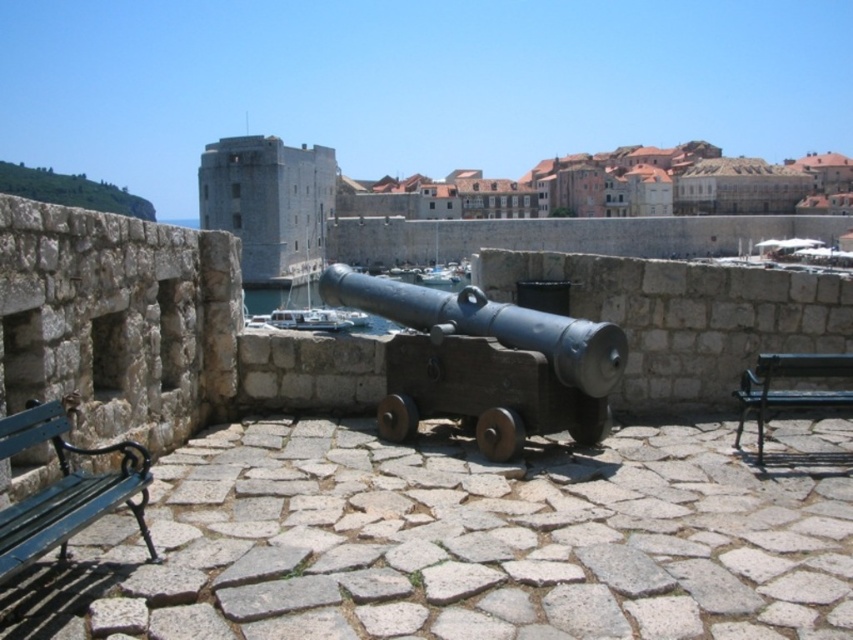
Is smooth stone cannon at center below green wooden bench at lower left?

Actually, smooth stone cannon at center is above green wooden bench at lower left.

Between smooth stone cannon at center and green wooden bench at lower left, which one is positioned higher?

smooth stone cannon at center

Identify the location of smooth stone cannon at center. (489, 209).

Is point (436, 337) farther from camera compared to point (3, 540)?

Yes.

The height and width of the screenshot is (640, 853). Describe the element at coordinates (485, 362) in the screenshot. I see `matte black cannon at center` at that location.

You are a GUI agent. You are given a task and a screenshot of the screen. Output one action in this format:
    pyautogui.click(x=<x>, y=<y>)
    Task: Click on the matte black cannon at center
    The width and height of the screenshot is (853, 640).
    Given the screenshot: What is the action you would take?
    pyautogui.click(x=485, y=362)

Can you confirm if smooth stone cannon at center is positioned to the left of matte black cannon at center?

No, smooth stone cannon at center is not to the left of matte black cannon at center.

Who is taller, smooth stone cannon at center or matte black cannon at center?

smooth stone cannon at center

Does point (412, 208) come in front of point (608, 324)?

No, (412, 208) is behind (608, 324).

Identify the location of smooth stone cannon at center. (489, 209).